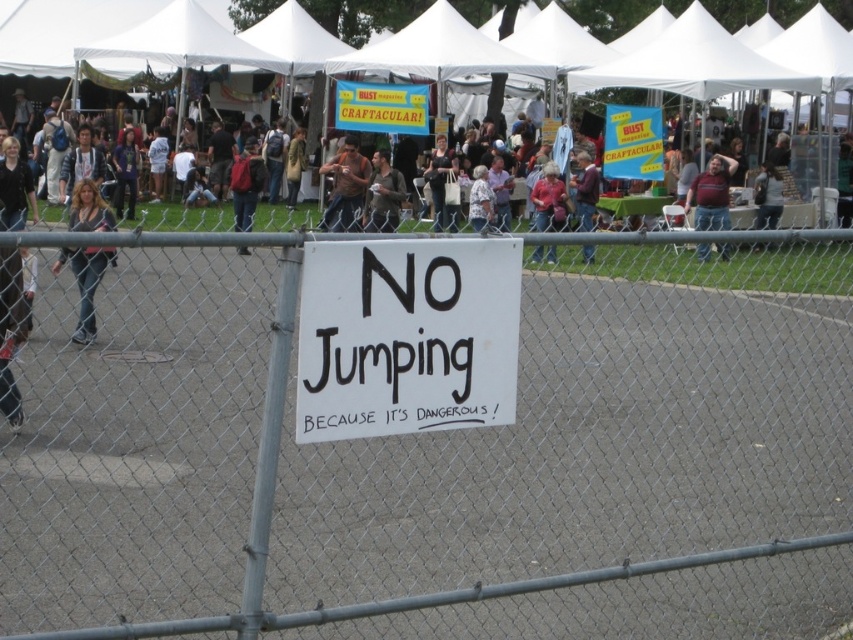
You are a photographer trying to capture a clear shot of the dark brown hair at left and the red backpack at center. Which object should you focus on first if you want to ensure both are in focus without adjusting your camera settings?

The dark brown hair at left is shorter than the red backpack at center, so you should focus on the red backpack at center first. This way, since it is farther away, the depth of field will also include the closer dark brown hair at left.

You are a photographer trying to capture a wide shot of the event. The fat man in jeans at right and the matte black bag at center are in your frame. Based on their sizes, which object would appear larger in your photo?

The fat man in jeans at right would appear larger in the photo since his width surpasses that of the matte black bag at center.